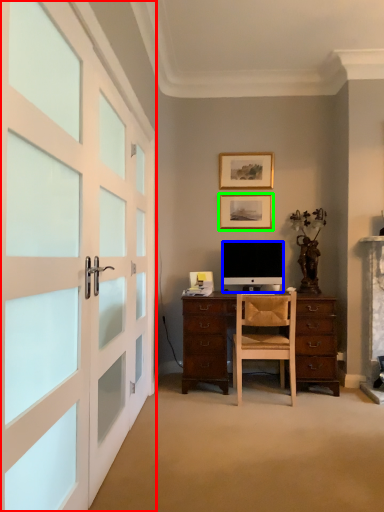
Question: Estimate the real-world distances between objects in this image. Which object is closer to garage door (highlighted by a red box), television (highlighted by a blue box) or picture frame (highlighted by a green box)?

Choices:
 (A) television
 (B) picture frame

Answer: (A)